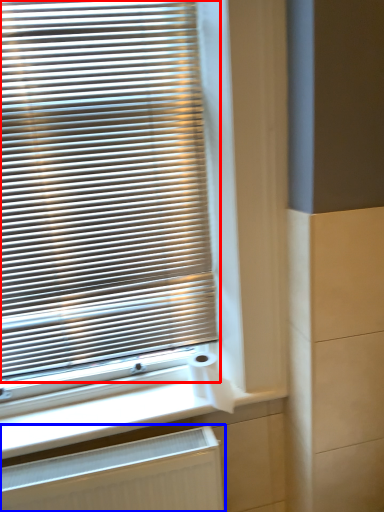
Question: Among these objects, which one is nearest to the camera, window blind (highlighted by a red box) or radiator (highlighted by a blue box)?

Choices:
 (A) window blind
 (B) radiator

Answer: (A)